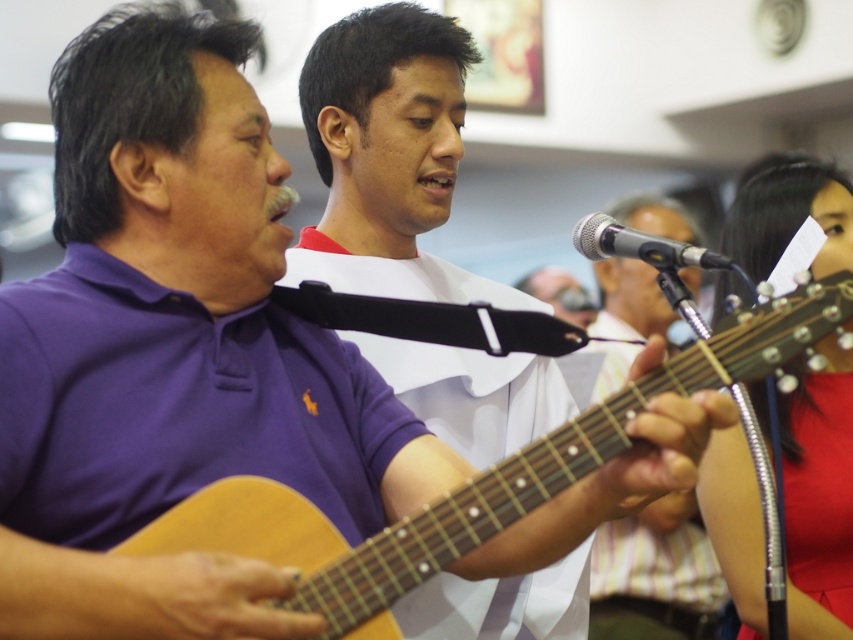
Question: Is matte purple polo shirt at center positioned behind silver metallic microphone at center?

Choices:
 (A) no
 (B) yes

Answer: (A)

Question: Is light brown acoustic guitar at left thinner than silver metallic microphone at center?

Choices:
 (A) no
 (B) yes

Answer: (A)

Question: Which object is the closest to the light brown acoustic guitar at left?

Choices:
 (A) wooden acoustic guitar at center
 (B) matte purple polo shirt at center
 (C) silver metallic microphone at center

Answer: (B)

Question: Which of the following is the farthest from the observer?

Choices:
 (A) (650, 253)
 (B) (265, 522)
 (C) (697, 240)

Answer: (C)

Question: Can you confirm if light brown acoustic guitar at left is positioned above wooden acoustic guitar at center?

Choices:
 (A) yes
 (B) no

Answer: (B)

Question: Estimate the real-world distances between objects in this image. Which object is closer to the light brown acoustic guitar at left?

Choices:
 (A) wooden acoustic guitar at center
 (B) silver metallic microphone at center

Answer: (B)